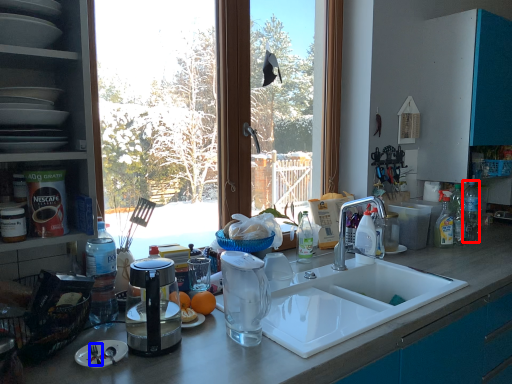
Question: Which object is further to the camera taking this photo, bottle (highlighted by a red box) or silverware (highlighted by a blue box)?

Choices:
 (A) bottle
 (B) silverware

Answer: (A)